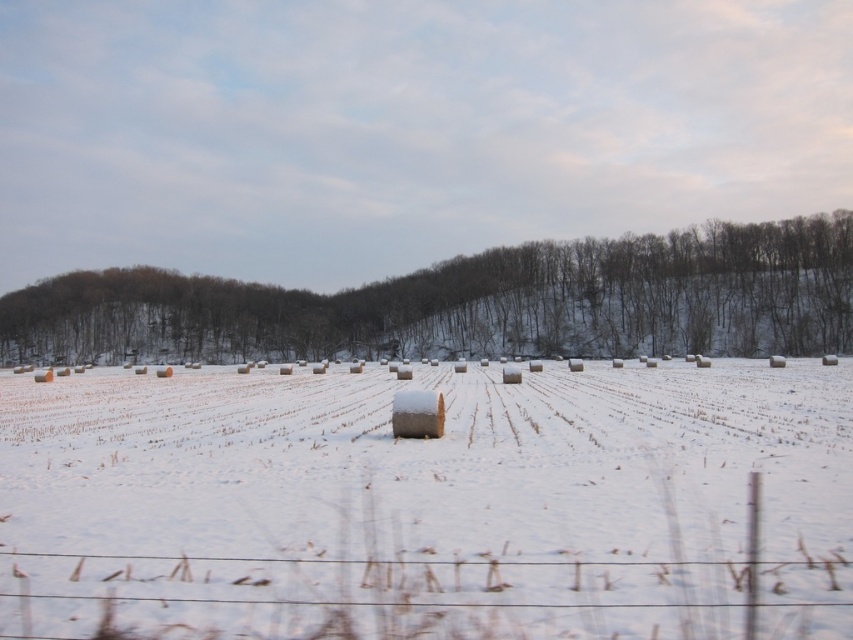
Which is behind, point (846, 515) or point (351, 304)?

The point (351, 304) is behind.

Which is behind, point (529, 628) or point (196, 278)?

Point (196, 278)

Locate an element on the screen. snow-covered hay bale at center is located at coordinates (427, 502).